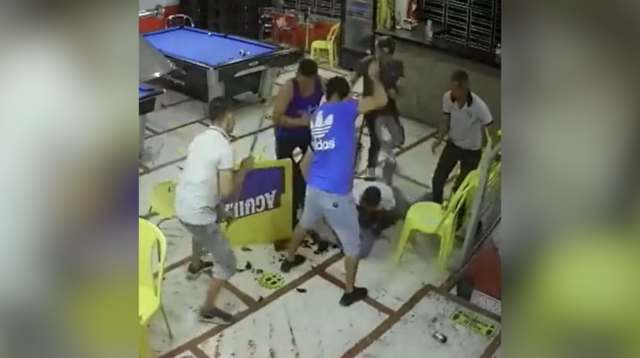
At what (x,y) coordinates should I click in order to perform the action: click on pool cue. Please return your answer as a coordinate pair (x, y). The image size is (640, 358). Looking at the image, I should click on (259, 131), (364, 127).